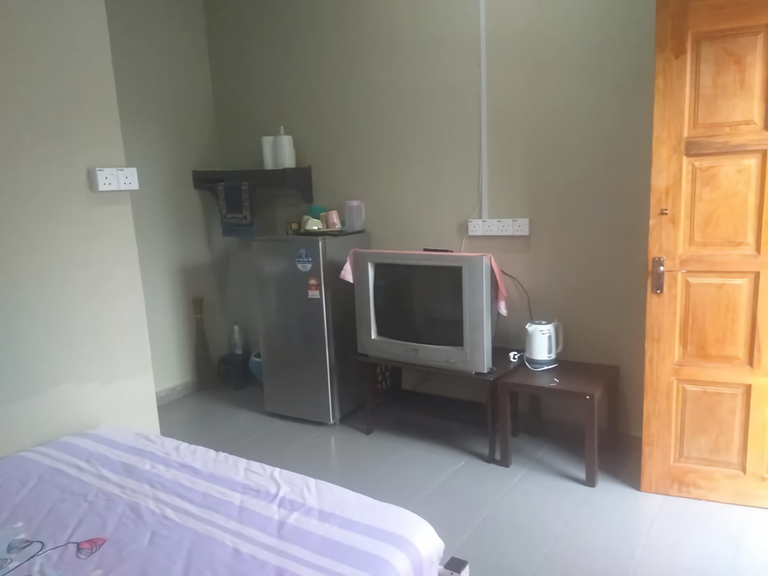
I want to click on hand towel, so pos(227,208).